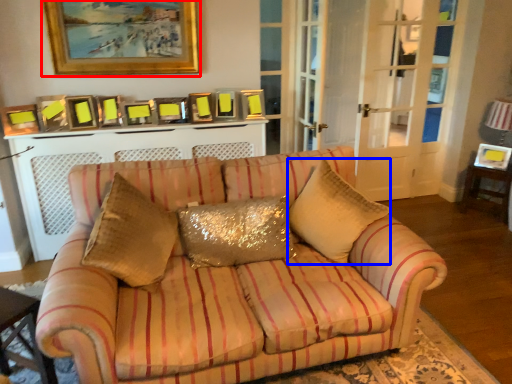
Question: Which object is closer to the camera taking this photo, picture frame (highlighted by a red box) or throw pillow (highlighted by a blue box)?

Choices:
 (A) picture frame
 (B) throw pillow

Answer: (B)